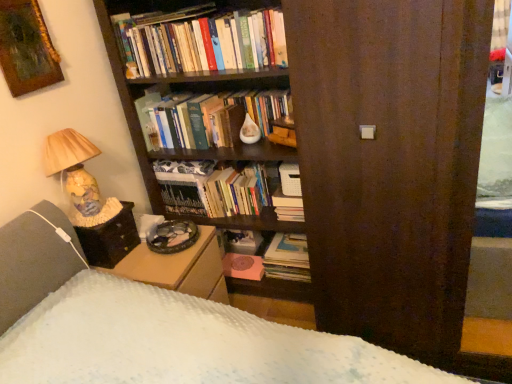
What is the approximate height of wooden framed painting at upper left?

wooden framed painting at upper left is 13.83 inches tall.

Describe the element at coordinates (202, 40) in the screenshot. Image resolution: width=512 pixels, height=384 pixels. I see `hardcover books at upper center, the first book positioned from the top` at that location.

How much space does matte paper stack of books at center, the fourth book when ordered from top to bottom, occupy horizontally?

matte paper stack of books at center, the fourth book when ordered from top to bottom, is 11.12 inches wide.

Where is `wooden framed painting at upper left`? This screenshot has width=512, height=384. wooden framed painting at upper left is located at coordinates (26, 48).

Is hardcover books at upper center, the first book positioned from the top, at the back of brown wood screen door at center?

brown wood screen door at center does not have its back to hardcover books at upper center, the first book positioned from the top.

Which is more to the left, brown wood screen door at center or hardcover books at upper center, the first book positioned from the top?

hardcover books at upper center, the first book positioned from the top.

Looking at this image, considering the sizes of brown wood screen door at center and hardcover books at upper center, the first book positioned from the top, in the image, is brown wood screen door at center taller or shorter than hardcover books at upper center, the first book positioned from the top,?

In the image, brown wood screen door at center appears to be taller than hardcover books at upper center, the first book positioned from the top.

At what (x,y) coordinates should I click in order to perform the action: click on screen door below the hardcover books at upper center, the 4th book in the bottom-to-top sequence (from the image's perspective). Please return your answer as a coordinate pair (x, y). The image size is (512, 384). Looking at the image, I should click on (390, 162).

From a real-world perspective, is hardcover book at center, which appears as the 3th book when viewed from the top, above or below brown wood screen door at center?

hardcover book at center, which appears as the 3th book when viewed from the top, is below brown wood screen door at center.

Can you confirm if hardcover book at center, arranged as the 2th book when ordered from the bottom, is taller than brown wood screen door at center?

No.

Is the surface of brown wood screen door at center in direct contact with black fabric table at lower left?

No, brown wood screen door at center is not in contact with black fabric table at lower left.

Is brown wood screen door at center not inside black fabric table at lower left?

brown wood screen door at center lies outside black fabric table at lower left's area.

Does point (405, 285) appear closer or farther from the camera than point (100, 232)?

Clearly, point (405, 285) is closer to the camera than point (100, 232).

From a real-world perspective, is brown wood screen door at center located beneath black fabric table at lower left?

No, from a real-world perspective, brown wood screen door at center is not beneath black fabric table at lower left.

From the image's perspective, is hardcover book at center, arranged as the 2th book when ordered from the bottom, located beneath hardcover book at center, marked as the second book in a top-to-bottom arrangement?

Yes.

From a real-world perspective, is hardcover book at center, arranged as the 2th book when ordered from the bottom, physically above hardcover book at center, acting as the 3th book starting from the bottom?

Incorrect, from a real-world perspective, hardcover book at center, arranged as the 2th book when ordered from the bottom, is lower than hardcover book at center, acting as the 3th book starting from the bottom.

Which of these two, hardcover book at center, arranged as the 2th book when ordered from the bottom, or hardcover book at center, marked as the second book in a top-to-bottom arrangement, is thinner?

Thinner between the two is hardcover book at center, arranged as the 2th book when ordered from the bottom.

Are hardcover book at center, which appears as the 3th book when viewed from the top, and hardcover book at center, acting as the 3th book starting from the bottom, located far from each other?

hardcover book at center, which appears as the 3th book when viewed from the top, is actually quite close to hardcover book at center, acting as the 3th book starting from the bottom.

Can you confirm if hardcover books at upper center, the first book positioned from the top, is positioned to the left of hardcover book at center, arranged as the 2th book when ordered from the bottom?

Indeed, hardcover books at upper center, the first book positioned from the top, is positioned on the left side of hardcover book at center, arranged as the 2th book when ordered from the bottom.

From a real-world perspective, relative to hardcover book at center, which appears as the 3th book when viewed from the top, is hardcover books at upper center, the 4th book in the bottom-to-top sequence, vertically above or below?

From a real-world perspective, hardcover books at upper center, the 4th book in the bottom-to-top sequence, is physically above hardcover book at center, which appears as the 3th book when viewed from the top.

Is point (188, 51) farther from viewer compared to point (289, 217)?

No.

Is hardcover books at upper center, the 4th book in the bottom-to-top sequence, surrounding hardcover book at center, arranged as the 2th book when ordered from the bottom?

No, hardcover book at center, arranged as the 2th book when ordered from the bottom, is not surrounded by hardcover books at upper center, the 4th book in the bottom-to-top sequence.

Considering the positions of objects black fabric table at lower left and hardcover books at upper center, the 4th book in the bottom-to-top sequence, in the image provided, who is behind, black fabric table at lower left or hardcover books at upper center, the 4th book in the bottom-to-top sequence,?

hardcover books at upper center, the 4th book in the bottom-to-top sequence, is more distant.

Considering the positions of objects black fabric table at lower left and hardcover books at upper center, the 4th book in the bottom-to-top sequence, in the image provided, who is more to the right, black fabric table at lower left or hardcover books at upper center, the 4th book in the bottom-to-top sequence,?

Positioned to the right is hardcover books at upper center, the 4th book in the bottom-to-top sequence.

Between point (116, 216) and point (163, 35), which one is positioned in front?

The point (116, 216) is more forward.

From a real-world perspective, relative to hardcover books at upper center, the first book positioned from the top, is black fabric table at lower left vertically above or below?

From a real-world perspective, black fabric table at lower left is physically below hardcover books at upper center, the first book positioned from the top.

The image size is (512, 384). What are the coordinates of `the 2nd book above when counting from the hardcover book at center, arranged as the 2th book when ordered from the bottom (from the image's perspective)` in the screenshot? It's located at (202, 40).

How different are the orientations of hardcover book at center, arranged as the 2th book when ordered from the bottom, and hardcover books at upper center, the first book positioned from the top, in degrees?

The angular difference between hardcover book at center, arranged as the 2th book when ordered from the bottom, and hardcover books at upper center, the first book positioned from the top, is 2.88 degrees.

Between hardcover book at center, which appears as the 3th book when viewed from the top, and hardcover books at upper center, the first book positioned from the top, which one has smaller width?

hardcover books at upper center, the first book positioned from the top.

Looking at the image, does hardcover book at center, which appears as the 3th book when viewed from the top, seem bigger or smaller compared to hardcover books at upper center, the 4th book in the bottom-to-top sequence?

hardcover book at center, which appears as the 3th book when viewed from the top, is smaller than hardcover books at upper center, the 4th book in the bottom-to-top sequence.

Locate an element on the screen. This screenshot has height=384, width=512. screen door that appears below the hardcover books at upper center, the 4th book in the bottom-to-top sequence (from a real-world perspective) is located at coordinates click(390, 162).

Which book is the 2nd one when counting from the back of the brown wood screen door at center? Please provide its 2D coordinates.

[(288, 207)]

Looking at the image, which one is located further to hardcover book at center, marked as the second book in a top-to-bottom arrangement, matte paper stack of books at center, marked as the 1th book in a bottom-to-top arrangement, or black fabric table at lower left?

black fabric table at lower left is positioned further to the anchor hardcover book at center, marked as the second book in a top-to-bottom arrangement.

Looking at the image, which one is located closer to hardcover book at center, marked as the second book in a top-to-bottom arrangement, brown wood screen door at center or hardcover book at center, arranged as the 2th book when ordered from the bottom?

hardcover book at center, arranged as the 2th book when ordered from the bottom, lies closer to hardcover book at center, marked as the second book in a top-to-bottom arrangement, than the other object.

Based on their spatial positions, is black fabric table at lower left or hardcover books at upper center, the first book positioned from the top, closer to brown wood screen door at center?

Among the two, hardcover books at upper center, the first book positioned from the top, is located nearer to brown wood screen door at center.

Considering their positions, is black fabric table at lower left positioned further to matte paper stack of books at center, marked as the 1th book in a bottom-to-top arrangement, than hardcover books at upper center, the 4th book in the bottom-to-top sequence?

hardcover books at upper center, the 4th book in the bottom-to-top sequence, lies further to matte paper stack of books at center, marked as the 1th book in a bottom-to-top arrangement, than the other object.

Which object lies nearer to the anchor point brown wood screen door at center, hardcover books at upper center, the 4th book in the bottom-to-top sequence, or black fabric table at lower left?

hardcover books at upper center, the 4th book in the bottom-to-top sequence, lies closer to brown wood screen door at center than the other object.

From the image, which object appears to be farther from black fabric table at lower left, hardcover book at center, which appears as the 3th book when viewed from the top, or wooden framed painting at upper left?

Among the two, hardcover book at center, which appears as the 3th book when viewed from the top, is located further to black fabric table at lower left.

Considering their positions, is wooden framed painting at upper left positioned further to hardcover book at center, acting as the 3th book starting from the bottom, than hardcover book at center, arranged as the 2th book when ordered from the bottom?

Based on the image, wooden framed painting at upper left appears to be further to hardcover book at center, acting as the 3th book starting from the bottom.

From the image, which object appears to be farther from black fabric table at lower left, wooden framed painting at upper left or hardcover book at center, marked as the second book in a top-to-bottom arrangement?

The object further to black fabric table at lower left is wooden framed painting at upper left.

You are a GUI agent. You are given a task and a screenshot of the screen. Output one action in this format:
    pyautogui.click(x=<x>, y=<y>)
    Task: Click on the book between hardcover books at upper center, the first book positioned from the top, and hardcover book at center, arranged as the 2th book when ordered from the bottom, from top to bottom
    This screenshot has height=384, width=512.
    Given the screenshot: What is the action you would take?
    pyautogui.click(x=216, y=187)

The width and height of the screenshot is (512, 384). Find the location of `picture frame between hardcover books at upper center, the 4th book in the bottom-to-top sequence, and matte paper stack of books at center, the fourth book when ordered from top to bottom, from top to bottom`. picture frame between hardcover books at upper center, the 4th book in the bottom-to-top sequence, and matte paper stack of books at center, the fourth book when ordered from top to bottom, from top to bottom is located at coordinates (26, 48).

At what (x,y) coordinates should I click in order to perform the action: click on table between wooden framed painting at upper left and matte paper stack of books at center, marked as the 1th book in a bottom-to-top arrangement, from left to right. Please return your answer as a coordinate pair (x, y). Image resolution: width=512 pixels, height=384 pixels. Looking at the image, I should click on (110, 238).

Identify the location of table located between wooden framed painting at upper left and brown wood screen door at center in the left-right direction. The height and width of the screenshot is (384, 512). (110, 238).